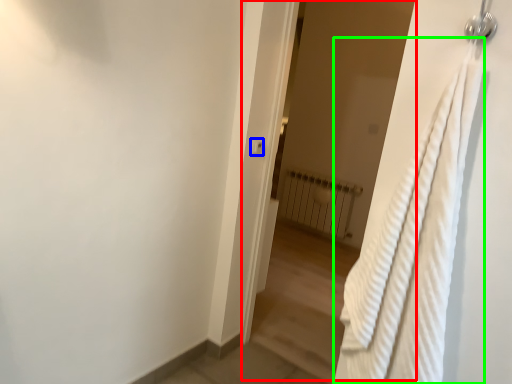
Question: Which object is the farthest from screen door (highlighted by a red box)? Choose among these: light switch (highlighted by a blue box) or bath towel (highlighted by a green box).

Choices:
 (A) light switch
 (B) bath towel

Answer: (B)